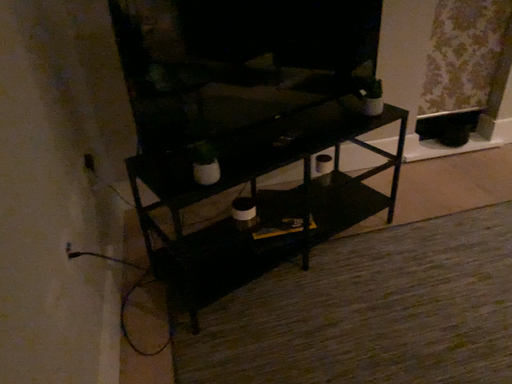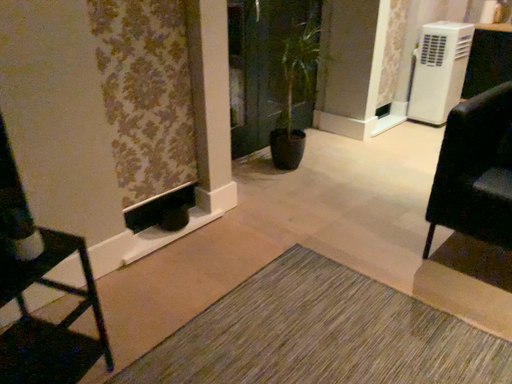
Question: How did the camera likely rotate when shooting the video?

Choices:
 (A) rotated upward
 (B) rotated downward

Answer: (A)